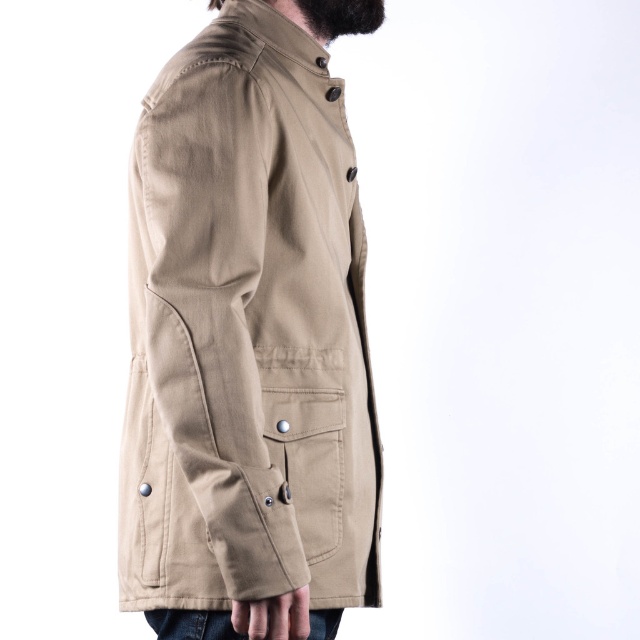
Which is more to the right, beige cotton coat at center or matte khaki pocket at center?

matte khaki pocket at center is more to the right.

In the scene shown: Does beige cotton coat at center appear on the left side of matte khaki pocket at center?

Indeed, beige cotton coat at center is positioned on the left side of matte khaki pocket at center.

Is point (342, 141) closer to viewer compared to point (308, 429)?

No, (342, 141) is further to viewer.

You are a GUI agent. You are given a task and a screenshot of the screen. Output one action in this format:
    pyautogui.click(x=<x>, y=<y>)
    Task: Click on the beige cotton coat at center
    The image size is (640, 640).
    Given the screenshot: What is the action you would take?
    pyautogui.click(x=246, y=332)

Is beige cotton coat at center positioned before black fuzzy beard at upper center?

Yes, beige cotton coat at center is closer to the viewer.

Does beige cotton coat at center appear on the left side of black fuzzy beard at upper center?

Yes, beige cotton coat at center is to the left of black fuzzy beard at upper center.

The height and width of the screenshot is (640, 640). What are the coordinates of `beige cotton coat at center` in the screenshot? It's located at (246, 332).

What are the coordinates of `beige cotton coat at center` in the screenshot? It's located at (x=246, y=332).

Is point (328, 448) less distant than point (326, 10)?

Yes.

Is matte khaki pocket at center to the left of black fuzzy beard at upper center from the viewer's perspective?

Indeed, matte khaki pocket at center is positioned on the left side of black fuzzy beard at upper center.

This screenshot has height=640, width=640. Describe the element at coordinates (307, 436) in the screenshot. I see `matte khaki pocket at center` at that location.

This screenshot has height=640, width=640. In order to click on matte khaki pocket at center in this screenshot , I will do `click(307, 436)`.